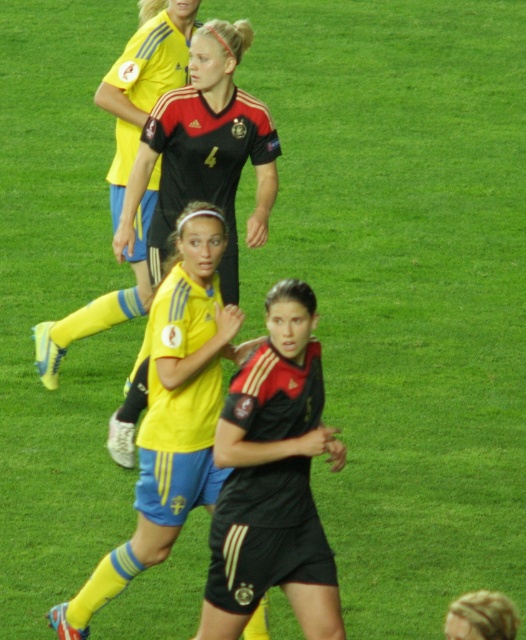
Question: Which of the following is the closest to the observer?

Choices:
 (A) (116, 106)
 (B) (222, 321)

Answer: (B)

Question: Does yellow matte jersey at center have a lesser width compared to black matte jersey at upper center?

Choices:
 (A) yes
 (B) no

Answer: (B)

Question: Which of the following is the farthest from the observer?

Choices:
 (A) yellow matte jersey at center
 (B) black matte jersey at upper center

Answer: (B)

Question: Can you confirm if yellow matte jersey at center is smaller than black matte jersey at upper center?

Choices:
 (A) no
 (B) yes

Answer: (A)

Question: Is yellow matte jersey at center closer to camera compared to black matte jersey at upper center?

Choices:
 (A) yes
 (B) no

Answer: (A)